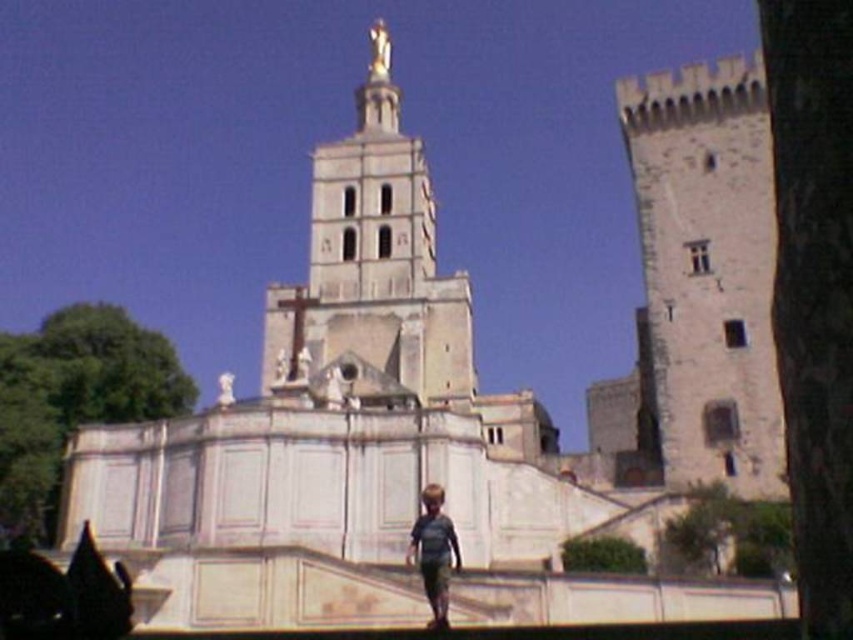
Question: Is the position of stone tower at right more distant than that of white stone tower at center?

Choices:
 (A) no
 (B) yes

Answer: (A)

Question: Which point is closer to the camera?

Choices:
 (A) white stone tower at center
 (B) stone tower at right
 (C) gray cotton shirt at center

Answer: (C)

Question: Does white stone tower at center appear on the left side of gray cotton shirt at center?

Choices:
 (A) no
 (B) yes

Answer: (B)

Question: Can you confirm if white stone tower at center is wider than gray cotton shirt at center?

Choices:
 (A) no
 (B) yes

Answer: (B)

Question: Which is farther from the white stone tower at center?

Choices:
 (A) gray cotton shirt at center
 (B) stone tower at right

Answer: (A)

Question: Which point appears closest to the camera in this image?

Choices:
 (A) (434, 522)
 (B) (355, 362)
 (C) (642, 250)

Answer: (A)